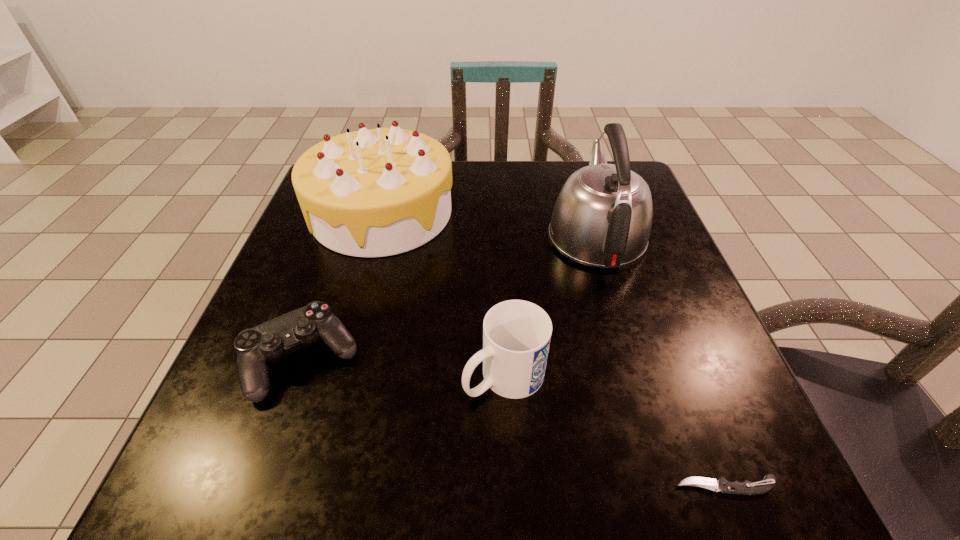
Where is `kettle`? The height and width of the screenshot is (540, 960). kettle is located at coordinates pyautogui.click(x=602, y=217).

At what (x,y) coordinates should I click in order to perform the action: click on birthday cake. Please return your answer as a coordinate pair (x, y). Looking at the image, I should click on (378, 192).

Find the location of `the third tallest object`. the third tallest object is located at coordinates (516, 334).

At what (x,y) coordinates should I click in order to perform the action: click on mug. Please return your answer as a coordinate pair (x, y). The width and height of the screenshot is (960, 540). Looking at the image, I should click on click(x=516, y=334).

Find the location of a particular element. The image size is (960, 540). control is located at coordinates (254, 346).

Locate an element on the screen. The width and height of the screenshot is (960, 540). the nearest object is located at coordinates (746, 487).

Locate an element on the screen. pocketknife is located at coordinates (746, 487).

The image size is (960, 540). Find the location of `vacant space located on the spout of the tallest object`. vacant space located on the spout of the tallest object is located at coordinates (579, 178).

Image resolution: width=960 pixels, height=540 pixels. What are the coordinates of `vacant space positioned 0.300m on the right of the second tallest object` in the screenshot? It's located at (586, 213).

At what (x,y) coordinates should I click in order to perform the action: click on free space located 0.140m on the back of the third object from right to left. Please return your answer as a coordinate pair (x, y). Looking at the image, I should click on (500, 287).